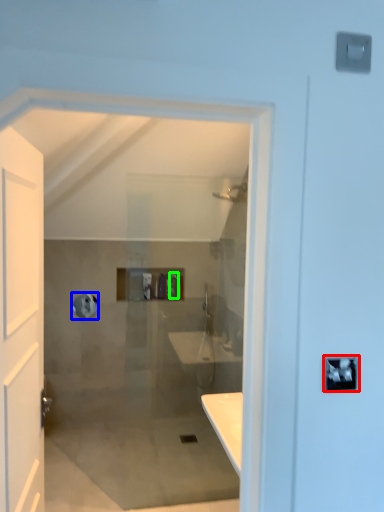
Question: Which object is positioned farthest from lock (highlighted by a red box)? Select from towel bar (highlighted by a blue box) and toiletry (highlighted by a green box).

Choices:
 (A) towel bar
 (B) toiletry

Answer: (A)